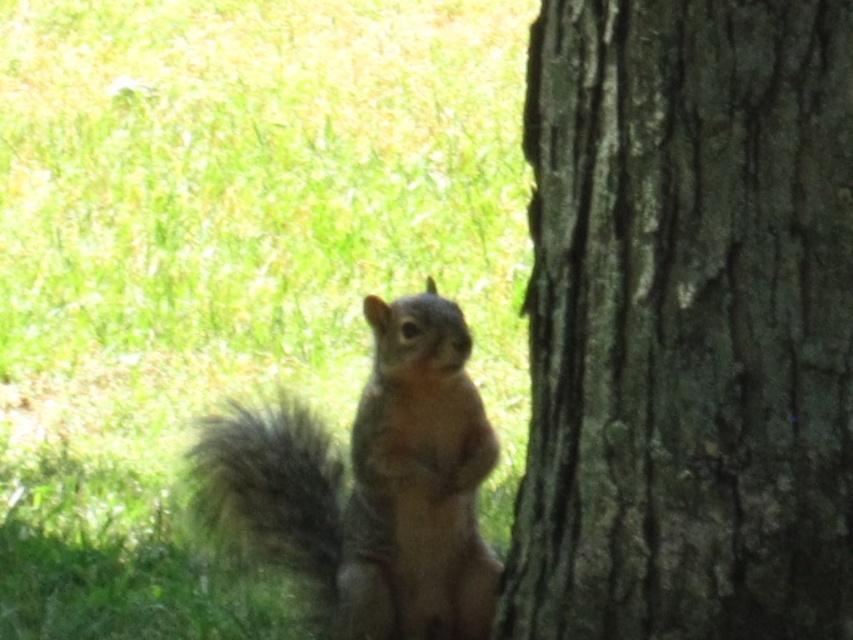
Which is below, dark brown rough bark at right or brown furry squirrel at center?

brown furry squirrel at center

This screenshot has height=640, width=853. I want to click on dark brown rough bark at right, so click(x=688, y=323).

Is point (258, 145) behind point (618, 596)?

That is True.

Does green grass at lower left have a lesser height compared to dark brown rough bark at right?

In fact, green grass at lower left may be taller than dark brown rough bark at right.

Which is in front, point (300, 138) or point (788, 326)?

Point (788, 326) is more forward.

Identify the location of green grass at lower left. (228, 264).

What do you see at coordinates (228, 264) in the screenshot? This screenshot has width=853, height=640. I see `green grass at lower left` at bounding box center [228, 264].

Based on the photo, does green grass at lower left lie behind brown furry squirrel at center?

Yes, it is.

This screenshot has height=640, width=853. Identify the location of green grass at lower left. (228, 264).

Where is `green grass at lower left`? The height and width of the screenshot is (640, 853). green grass at lower left is located at coordinates (228, 264).